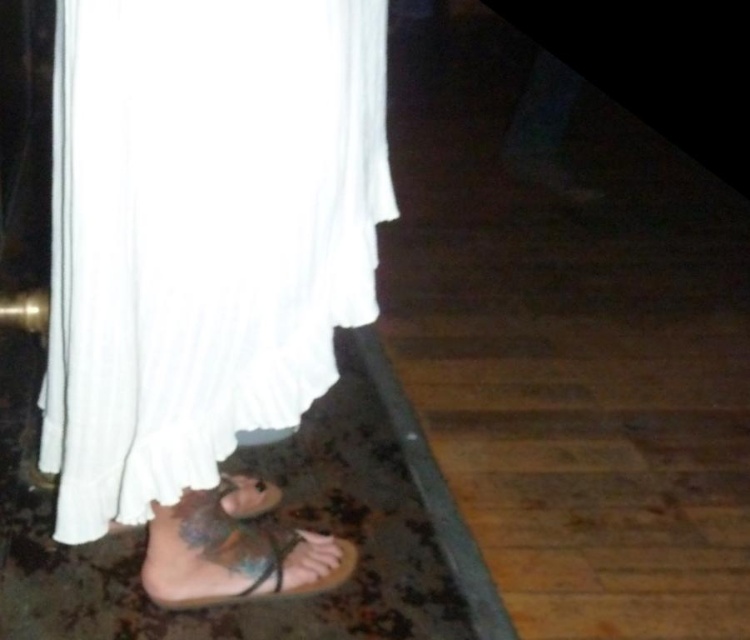
Which is behind, point (183, 282) or point (249, 596)?

Point (249, 596)

Where is `white cotton dress at lower left`? Image resolution: width=750 pixels, height=640 pixels. white cotton dress at lower left is located at coordinates (202, 234).